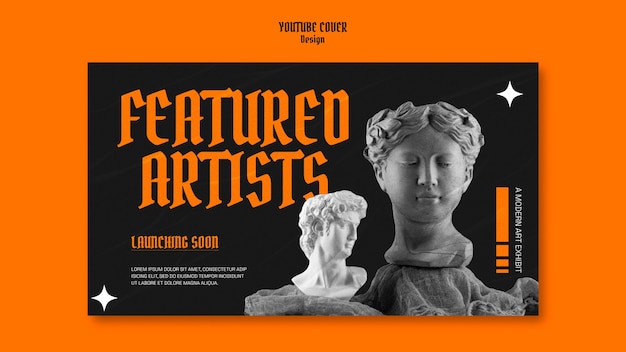
Where is `head sculptures`? The height and width of the screenshot is (352, 626). head sculptures is located at coordinates (337, 245), (434, 169).